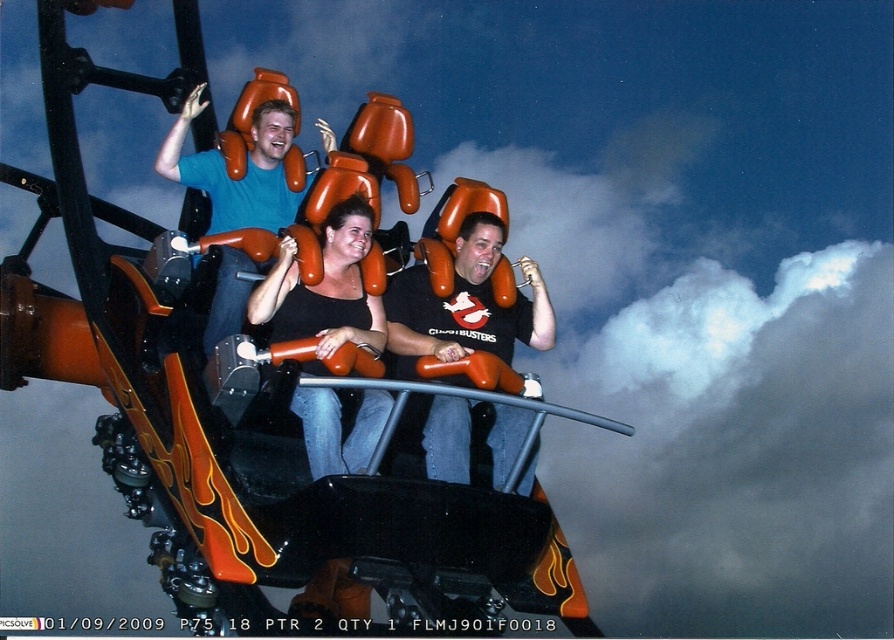
Between orange flame-painted roller coaster car at center and matte orange seat at center, which one has less height?

Standing shorter between the two is matte orange seat at center.

Does orange flame-painted roller coaster car at center come in front of matte orange seat at center?

That is True.

Consider the image. Who is more forward, (263,417) or (263,166)?

Point (263,417)

Locate an element on the screen. orange flame-painted roller coaster car at center is located at coordinates (246, 429).

Can you confirm if orange flame-painted roller coaster car at center is bigger than black matte ghostbusters t-shirt at center?

Yes, orange flame-painted roller coaster car at center is bigger than black matte ghostbusters t-shirt at center.

Does orange flame-painted roller coaster car at center have a smaller size compared to black matte ghostbusters t-shirt at center?

No.

This screenshot has height=640, width=894. What do you see at coordinates (246, 429) in the screenshot? I see `orange flame-painted roller coaster car at center` at bounding box center [246, 429].

Identify the location of orange flame-painted roller coaster car at center. The height and width of the screenshot is (640, 894). (246, 429).

Can you confirm if black matte ghostbusters t-shirt at center is positioned to the right of matte orange seat at center?

Yes, black matte ghostbusters t-shirt at center is to the right of matte orange seat at center.

What do you see at coordinates (465, 305) in the screenshot?
I see `black matte ghostbusters t-shirt at center` at bounding box center [465, 305].

Find the location of a particular element. The width and height of the screenshot is (894, 640). black matte ghostbusters t-shirt at center is located at coordinates (465, 305).